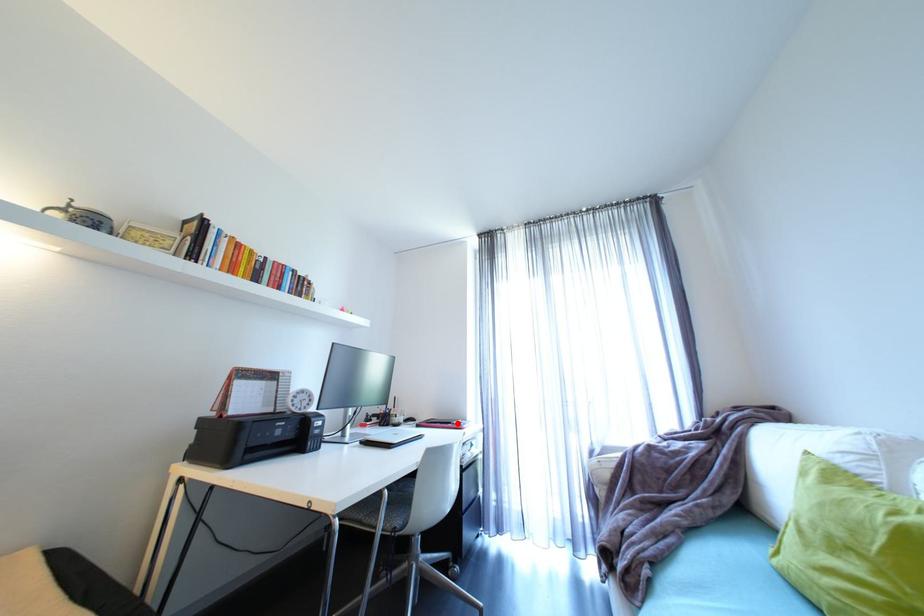
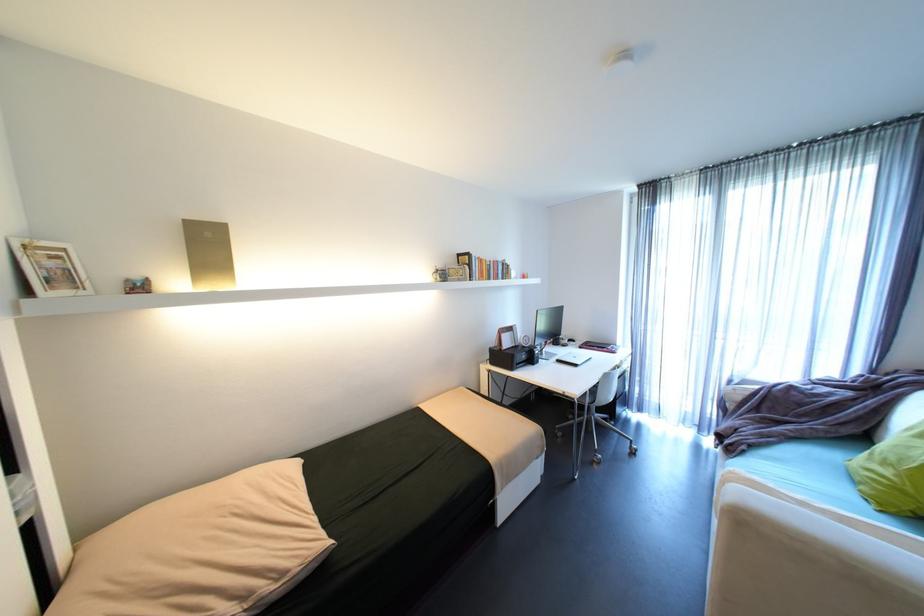
The point at the highlighted location is marked in the first image. Where is the corresponding point in the second image?

(612, 347)